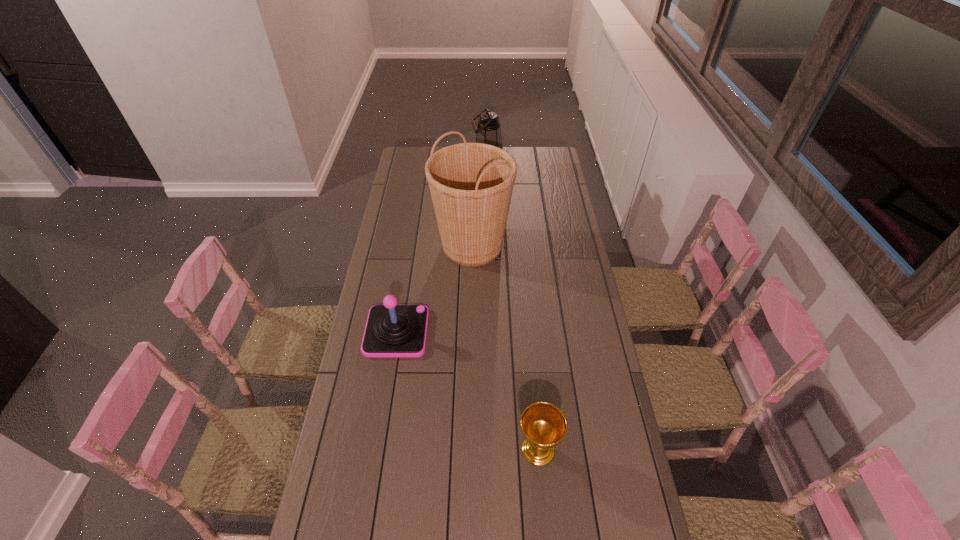
Image resolution: width=960 pixels, height=540 pixels. What are the coordinates of `free region located on the back of the chalice` in the screenshot? It's located at (530, 354).

Identify the location of object that is positioned at the far edge. (488, 131).

At what (x,y) coordinates should I click in order to perform the action: click on object located in the left edge section of the desktop. Please return your answer as a coordinate pair (x, y). The height and width of the screenshot is (540, 960). Looking at the image, I should click on (392, 330).

Find the location of a particular element. vacant space at the far edge of the desktop is located at coordinates (528, 153).

The height and width of the screenshot is (540, 960). In the image, there is a desktop. Identify the location of vacant space at the left edge. (398, 172).

Where is `vacant space at the right edge of the desktop`? The image size is (960, 540). vacant space at the right edge of the desktop is located at coordinates (553, 208).

In order to click on vacant space at the far left corner in this screenshot , I will do click(404, 163).

Locate an element on the screen. vacant space at the far right corner is located at coordinates (557, 169).

Find the location of a particular element. The image size is (960, 540). vacant space that is in between the chalice and the joystick is located at coordinates (468, 390).

You are a GUI agent. You are given a task and a screenshot of the screen. Output one action in this format:
    pyautogui.click(x=<x>, y=<y>)
    Task: Click on the vacant area that lies between the third nearest object and the shortest object
    
    Given the screenshot: What is the action you would take?
    pyautogui.click(x=505, y=347)